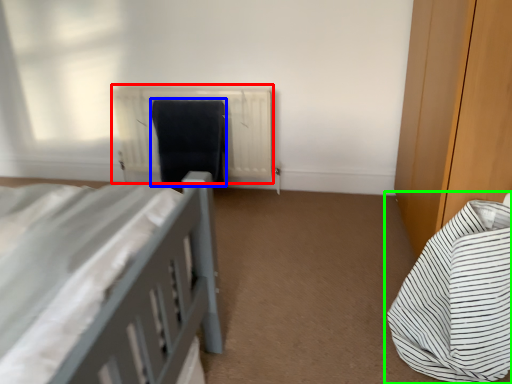
Question: Based on their relative distances, which object is nearer to radiator (highlighted by a red box)? Choose from laundry (highlighted by a blue box) and bed (highlighted by a green box).

Choices:
 (A) laundry
 (B) bed

Answer: (A)